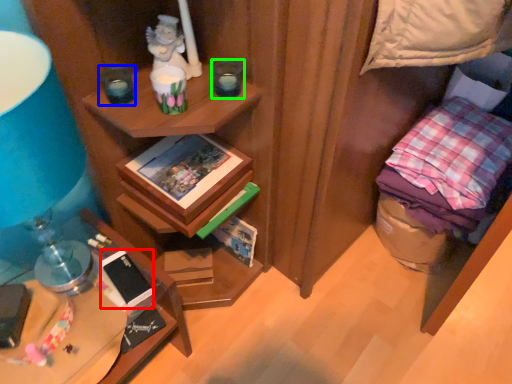
Question: Estimate the real-world distances between objects in this image. Which object is farther from mobile phone (highlighted by a red box), candle holder (highlighted by a blue box) or candle holder (highlighted by a green box)?

Choices:
 (A) candle holder
 (B) candle holder

Answer: (B)